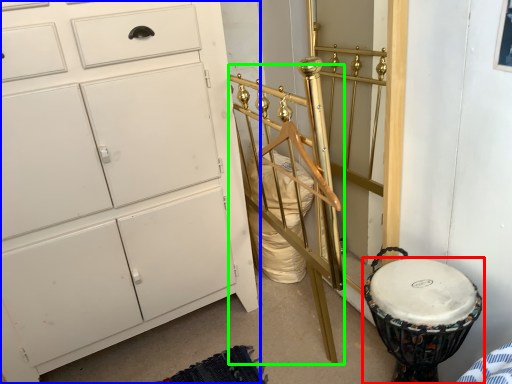
Question: Estimate the real-world distances between objects in this image. Which object is farther from drum (highlighted by a red box), chest of drawers (highlighted by a blue box) or bed frame (highlighted by a green box)?

Choices:
 (A) chest of drawers
 (B) bed frame

Answer: (A)